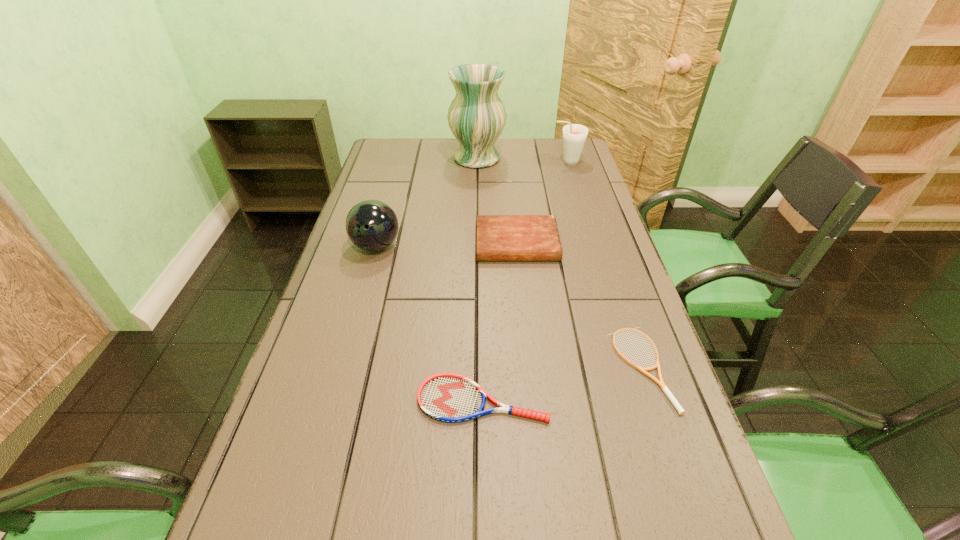
Find the location of a particular element. The height and width of the screenshot is (540, 960). free spot located 0.150m on the drink side of the root beer is located at coordinates (511, 162).

I want to click on free location located on the drink side of the root beer, so click(x=467, y=162).

Locate an element on the screen. This screenshot has height=540, width=960. vacant space positioned 0.070m on the side of the bowling ball with the finger holes is located at coordinates (367, 280).

This screenshot has height=540, width=960. In order to click on vacant space located on the spine side of the Bible in this screenshot , I will do `click(523, 306)`.

Locate an element on the screen. The width and height of the screenshot is (960, 540). vacant position located 0.140m on the right of the fifth tallest object is located at coordinates (618, 400).

Locate an element on the screen. Image resolution: width=960 pixels, height=540 pixels. vacant space located 0.340m on the left of the right tennis racket is located at coordinates (456, 368).

Image resolution: width=960 pixels, height=540 pixels. Find the location of `vase present at the far edge`. vase present at the far edge is located at coordinates (476, 116).

The height and width of the screenshot is (540, 960). Find the location of `root beer situated at the far edge`. root beer situated at the far edge is located at coordinates click(574, 135).

Where is `object situated at the left edge`? The height and width of the screenshot is (540, 960). object situated at the left edge is located at coordinates (371, 225).

Find the location of a particular element. The image size is (960, 540). root beer that is at the right edge is located at coordinates (574, 135).